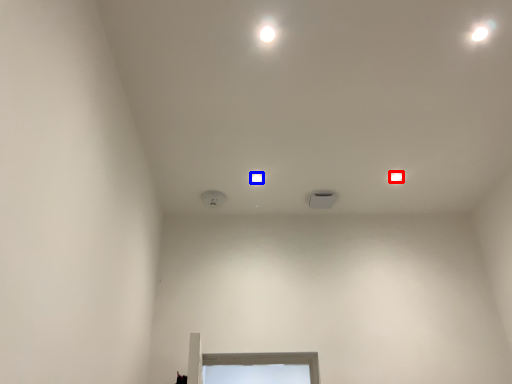
Question: Among these objects, which one is farthest to the camera, dot (highlighted by a red box) or dot (highlighted by a blue box)?

Choices:
 (A) dot
 (B) dot

Answer: (A)